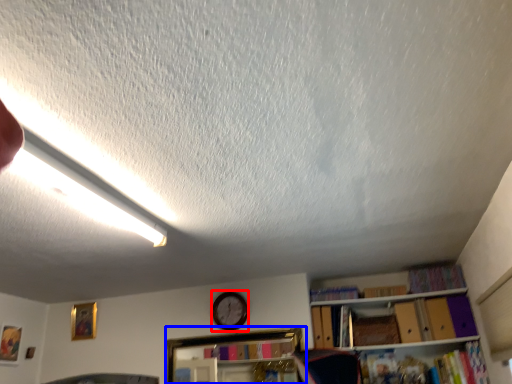
Question: Which object is further to the camera taking this photo, clock (highlighted by a red box) or shelf (highlighted by a blue box)?

Choices:
 (A) clock
 (B) shelf

Answer: (A)